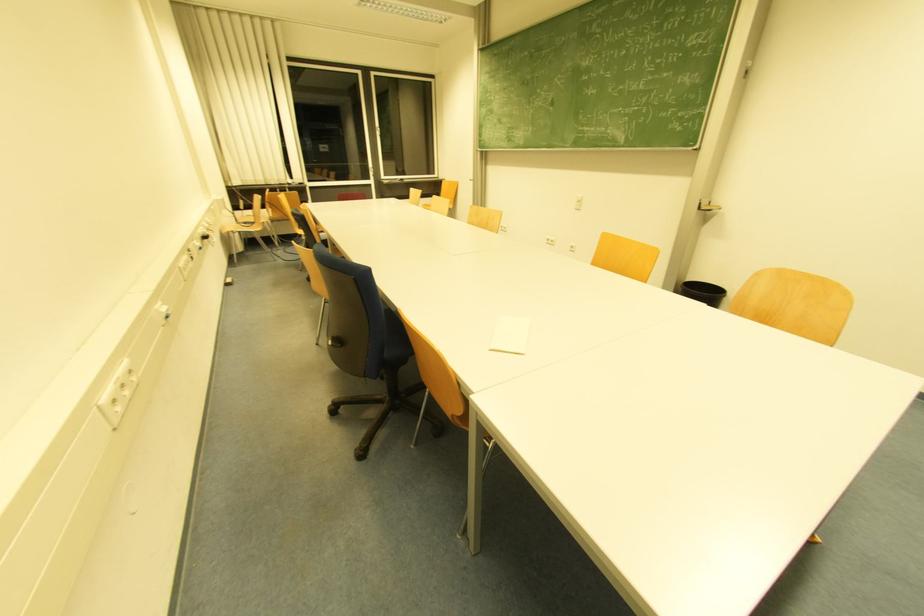
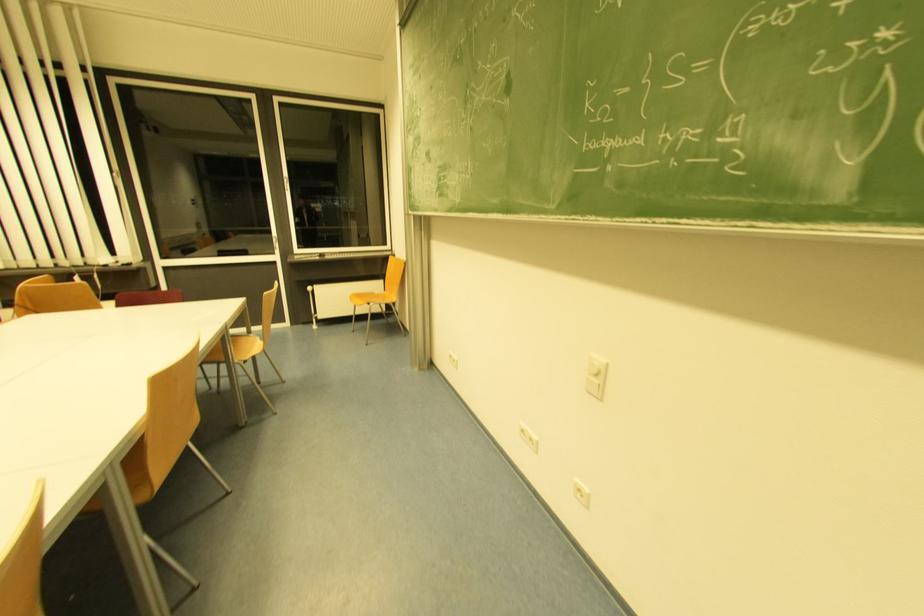
The images are taken continuously from a first-person perspective. In which direction are you moving?

The cameraman moved toward right, forward.